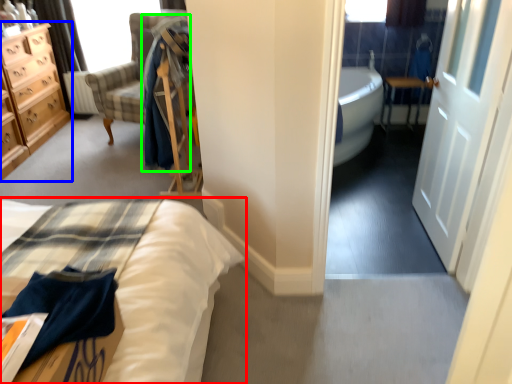
Question: Estimate the real-world distances between objects in this image. Which object is closer to bed (highlighted by a red box), chest of drawers (highlighted by a blue box) or robe (highlighted by a green box)?

Choices:
 (A) chest of drawers
 (B) robe

Answer: (B)